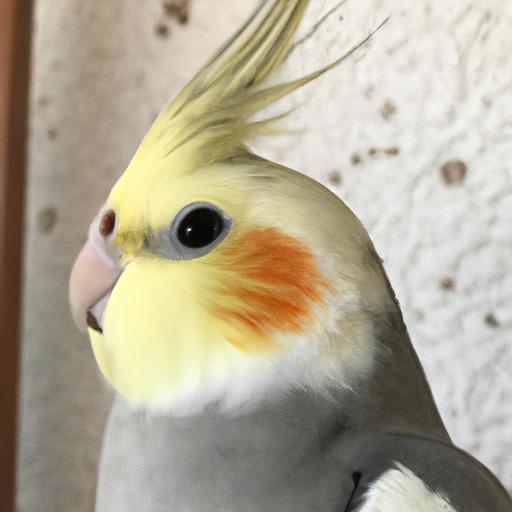
You are a GUI agent. You are given a task and a screenshot of the screen. Output one action in this format:
    pyautogui.click(x=<x>, y=<y>)
    Task: Click on the wooden doorway
    This screenshot has height=512, width=512.
    Given the screenshot: What is the action you would take?
    pyautogui.click(x=14, y=153)